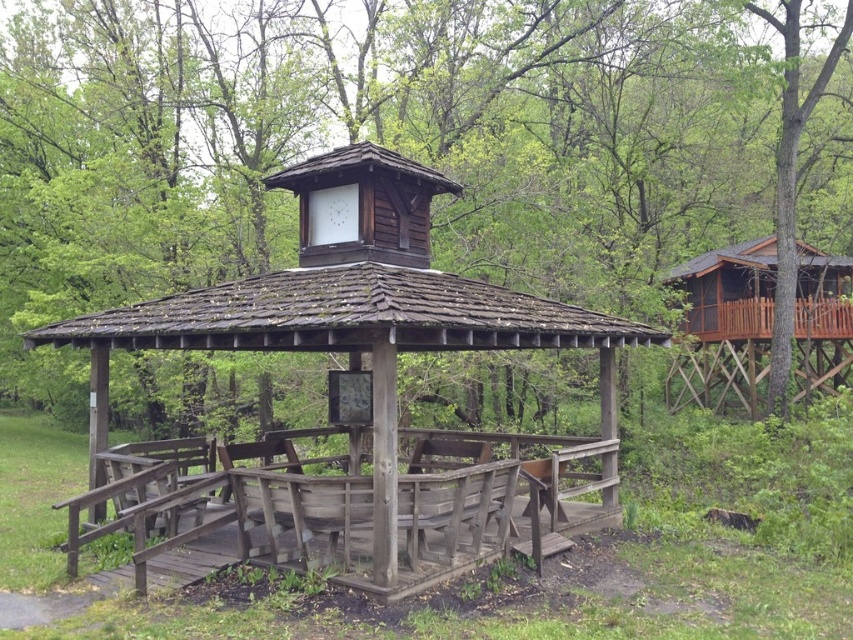
Consider the image. Between brown wooden gazebo at center and wooden cabin at right, which one appears on the right side from the viewer's perspective?

From the viewer's perspective, wooden cabin at right appears more on the right side.

Which is in front, point (138, 3) or point (708, 368)?

Positioned in front is point (138, 3).

Image resolution: width=853 pixels, height=640 pixels. What are the coordinates of `brown wooden gazebo at center` in the screenshot? It's located at pyautogui.click(x=378, y=138).

Locate an element on the screen. The width and height of the screenshot is (853, 640). brown wooden gazebo at center is located at coordinates (378, 138).

Who is more distant from viewer, (196, 348) or (737, 387)?

Positioned behind is point (737, 387).

Between weathered wood gazebo at center and wooden cabin at right, which one has less height?

weathered wood gazebo at center

Which is behind, point (131, 509) or point (769, 312)?

Point (769, 312)

Find the location of a particular element. Image resolution: width=853 pixels, height=640 pixels. weathered wood gazebo at center is located at coordinates (368, 390).

Is brown wooden gazebo at center thinner than weathered wood gazebo at center?

No.

Is brown wooden gazebo at center smaller than weathered wood gazebo at center?

No.

Which is in front, point (503, 208) or point (427, 269)?

Point (427, 269)

Identify the location of brown wooden gazebo at center. (378, 138).